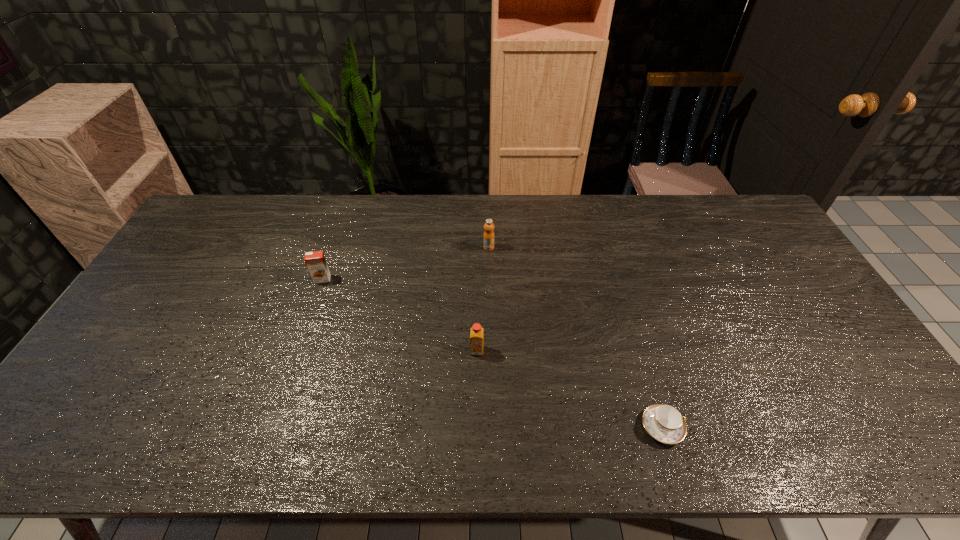
Where is `free space located on the right of the leftmost orange juice`? free space located on the right of the leftmost orange juice is located at coordinates (370, 279).

Find the location of `blank space located on the side with the handle of the shortest object`. blank space located on the side with the handle of the shortest object is located at coordinates (772, 427).

In order to click on object positioned at the near edge in this screenshot , I will do `click(663, 422)`.

Locate an element on the screen. free region at the far edge is located at coordinates (x=354, y=210).

Where is `vacant space at the near edge of the desktop`? vacant space at the near edge of the desktop is located at coordinates (699, 437).

In the image, there is a desktop. In order to click on vacant space at the left edge in this screenshot , I will do `click(148, 337)`.

The height and width of the screenshot is (540, 960). In the image, there is a desktop. Find the location of `vacant region at the right edge`. vacant region at the right edge is located at coordinates (761, 276).

The height and width of the screenshot is (540, 960). I want to click on free space at the far left corner of the desktop, so click(x=224, y=201).

In the image, there is a desktop. Where is `vacant space at the far right corner`? The height and width of the screenshot is (540, 960). vacant space at the far right corner is located at coordinates (752, 224).

Locate an element on the screen. free space between the teacup and the leftmost orange juice is located at coordinates (492, 353).